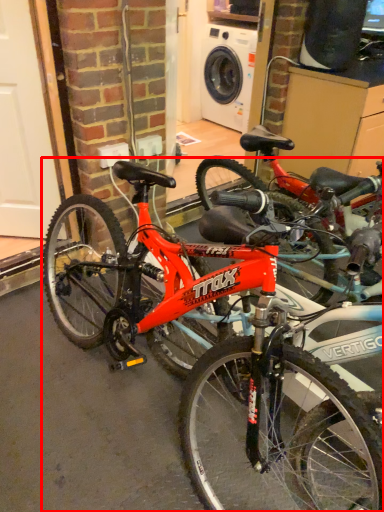
Question: From the image's perspective, where is bicycle (annotated by the red box) located in relation to garage door in the image?

Choices:
 (A) below
 (B) above

Answer: (A)